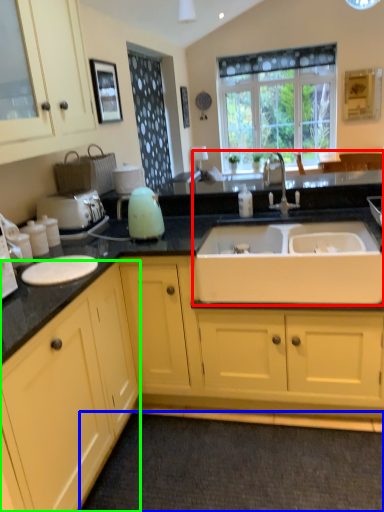
Question: Which object is the farthest from sink (highlighted by a red box)? Choose among these: plain (highlighted by a blue box) or cabinetry (highlighted by a green box).

Choices:
 (A) plain
 (B) cabinetry

Answer: (A)